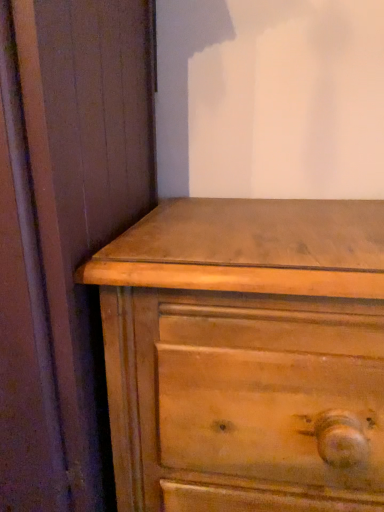
Question: Is light brown wood chest of drawers at center wider or thinner than matte wood dresser at lower right?

Choices:
 (A) wide
 (B) thin

Answer: (B)

Question: Is light brown wood chest of drawers at center bigger or smaller than matte wood dresser at lower right?

Choices:
 (A) small
 (B) big

Answer: (A)

Question: Is light brown wood chest of drawers at center taller or shorter than matte wood dresser at lower right?

Choices:
 (A) tall
 (B) short

Answer: (B)

Question: In the image, is matte wood dresser at lower right on the left side or the right side of light brown wood chest of drawers at center?

Choices:
 (A) left
 (B) right

Answer: (A)

Question: From the image's perspective, relative to light brown wood chest of drawers at center, is matte wood dresser at lower right above or below?

Choices:
 (A) below
 (B) above

Answer: (B)

Question: In terms of width, does matte wood dresser at lower right look wider or thinner when compared to light brown wood chest of drawers at center?

Choices:
 (A) wide
 (B) thin

Answer: (A)

Question: Is point (43, 419) positioned closer to the camera than point (168, 385)?

Choices:
 (A) farther
 (B) closer

Answer: (B)